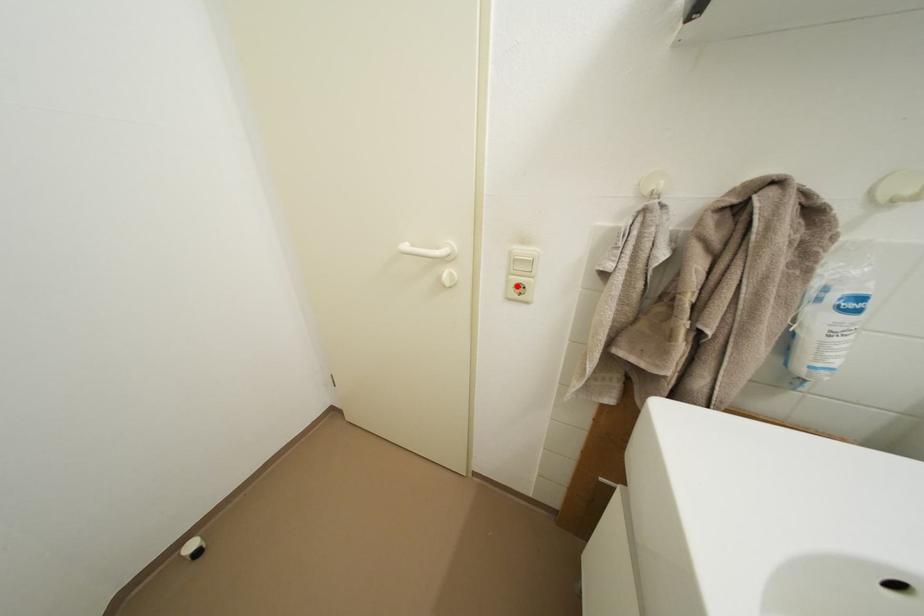
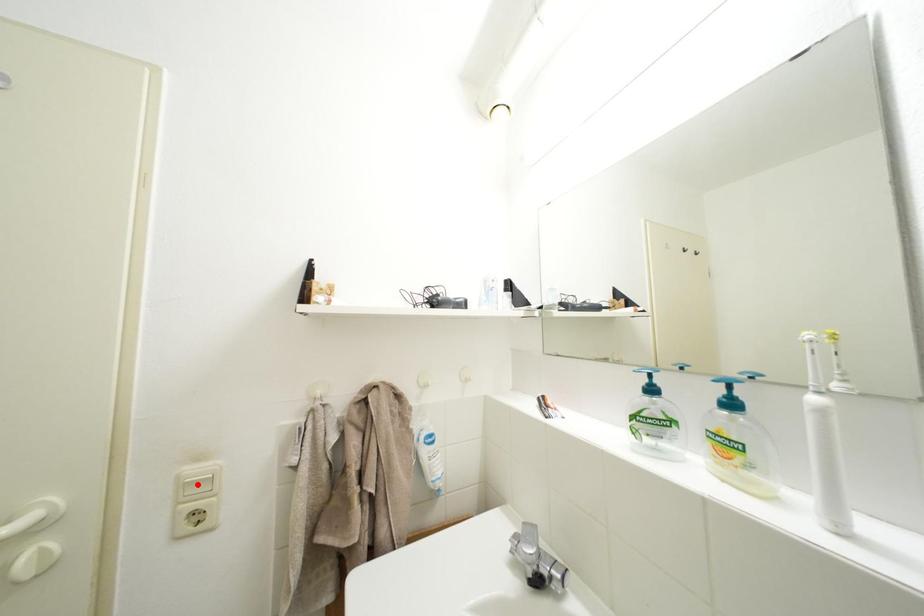
I am providing you with two images of the same scene from different viewpoints. A red point is marked on the first image and another point is marked on the second image. Are the points marked in image1 and image2 representing the same 3D position?

No